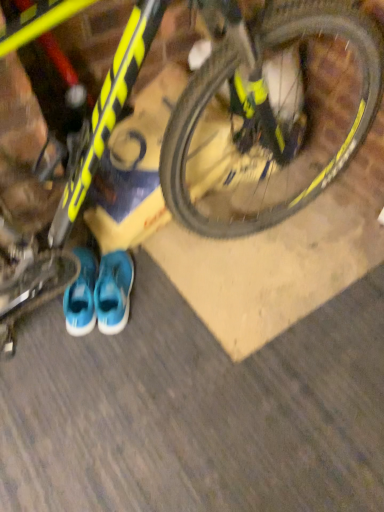
What are the coordinates of `vacant space in front of blue fabric running shoe at lower center` in the screenshot? It's located at (112, 349).